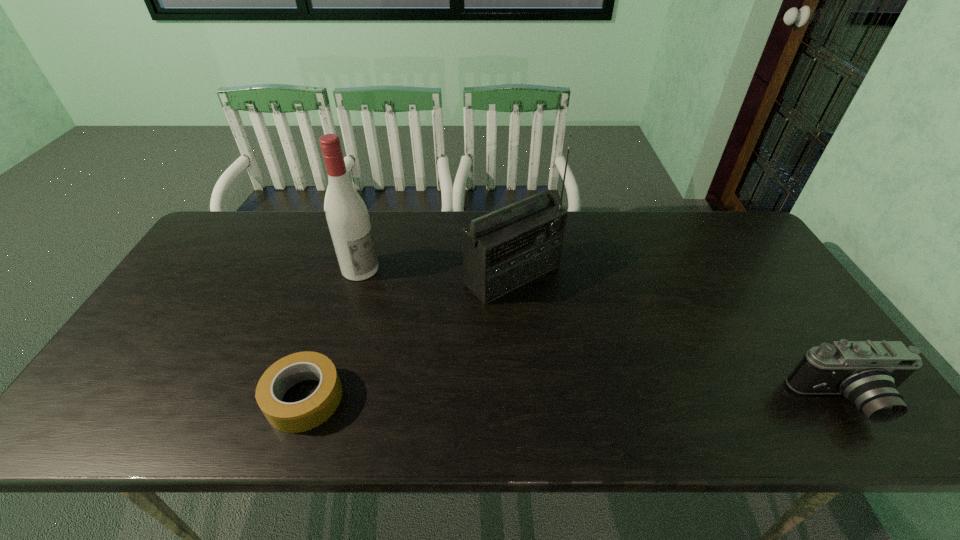
Locate an element on the screen. This screenshot has width=960, height=540. vacant space at the near edge of the desktop is located at coordinates (310, 381).

Image resolution: width=960 pixels, height=540 pixels. What are the coordinates of `free space at the left edge of the desktop` in the screenshot? It's located at (188, 277).

The width and height of the screenshot is (960, 540). In the image, there is a desktop. Find the location of `vacant area at the right edge`. vacant area at the right edge is located at coordinates (733, 259).

Where is `vacant space at the far left corner of the desktop`? The image size is (960, 540). vacant space at the far left corner of the desktop is located at coordinates (238, 224).

This screenshot has width=960, height=540. What are the coordinates of `vacant region at the near left corner of the desktop` in the screenshot? It's located at (x=112, y=369).

The image size is (960, 540). Identify the location of free space between the duct tape and the alcohol. (331, 334).

You are a GUI agent. You are given a task and a screenshot of the screen. Output one action in this format:
    pyautogui.click(x=<x>, y=<y>)
    Task: Click on the unoccupied position between the rightmost object and the duct tape
    The image size is (960, 540).
    Given the screenshot: What is the action you would take?
    pyautogui.click(x=575, y=400)

Locate an element on the screen. The width and height of the screenshot is (960, 540). free spot between the second shortest object and the third object from left to right is located at coordinates (681, 339).

Image resolution: width=960 pixels, height=540 pixels. Identify the location of free point between the shortest object and the radio receiver. (407, 336).

Find the location of a particular element. Image resolution: width=960 pixels, height=540 pixels. vacant space that's between the rightmost object and the alcohol is located at coordinates (604, 335).